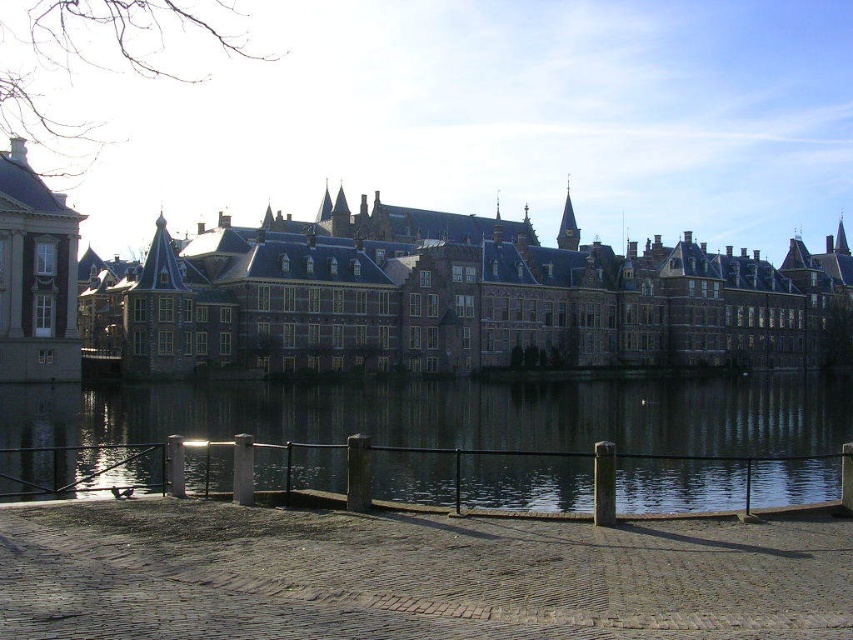
Question: Does brown brick castle at center appear on the left side of dark reflective water at center?

Choices:
 (A) yes
 (B) no

Answer: (B)

Question: Is brown brick castle at center positioned at the back of dark reflective water at center?

Choices:
 (A) no
 (B) yes

Answer: (B)

Question: Where is brown brick castle at center located in relation to dark reflective water at center in the image?

Choices:
 (A) below
 (B) above

Answer: (B)

Question: Which point is farther to the camera?

Choices:
 (A) brown brick castle at center
 (B) dark reflective water at center

Answer: (A)